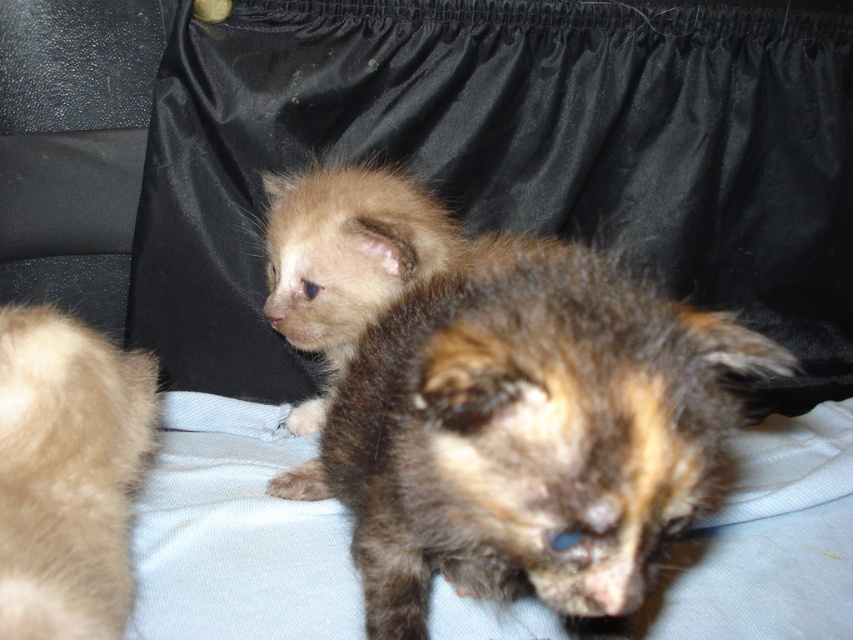
Image resolution: width=853 pixels, height=640 pixels. What do you see at coordinates (492, 400) in the screenshot? I see `brown fuzzy kitten at center` at bounding box center [492, 400].

Who is lower down, brown fuzzy kitten at center or light brown fur at left?

light brown fur at left is lower down.

Identify the location of brown fuzzy kitten at center. The width and height of the screenshot is (853, 640). (492, 400).